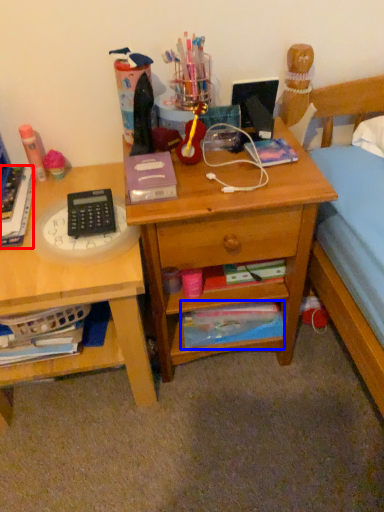
Question: Among these objects, which one is nearest to the camera, book (highlighted by a red box) or paperback book (highlighted by a blue box)?

Choices:
 (A) book
 (B) paperback book

Answer: (A)